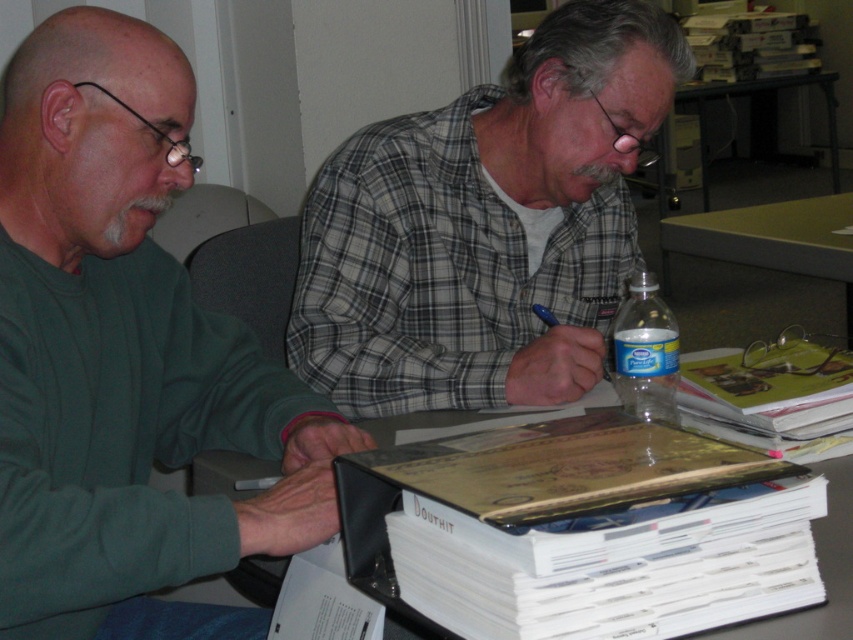
Question: Among these points, which one is nearest to the camera?

Choices:
 (A) (155, 280)
 (B) (775, 454)
 (C) (585, 196)
 (D) (665, 266)

Answer: (B)

Question: Among these points, which one is farthest from the camera?

Choices:
 (A) (821, 256)
 (B) (737, 637)
 (C) (248, 365)
 (D) (543, 202)

Answer: (A)

Question: Does white paper at center have a lesser width compared to green laminate table at center?

Choices:
 (A) no
 (B) yes

Answer: (A)

Question: Does green matte sweater at left have a lesser width compared to white paper at center?

Choices:
 (A) yes
 (B) no

Answer: (A)

Question: Is green matte sweater at left above plaid shirt at center?

Choices:
 (A) no
 (B) yes

Answer: (A)

Question: Which of the following is the farthest from the observer?

Choices:
 (A) white paper at center
 (B) green laminate table at center
 (C) plaid shirt at center
 (D) clear plastic bottle at center

Answer: (B)